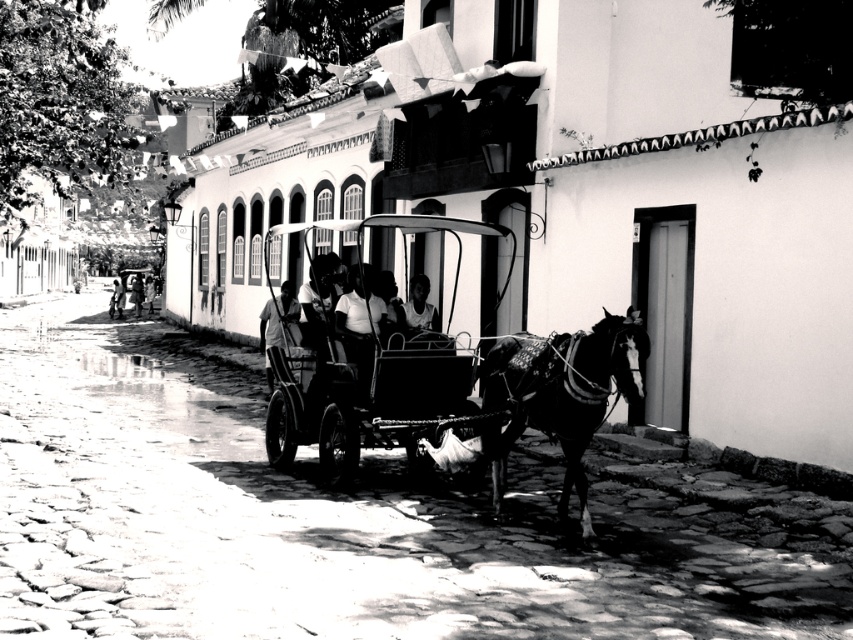
Question: Is shiny black horse at center to the left of smooth skin face at center from the viewer's perspective?

Choices:
 (A) yes
 (B) no

Answer: (B)

Question: Which of the following is the farthest from the observer?

Choices:
 (A) (422, 328)
 (B) (404, 220)
 (C) (515, 368)

Answer: (A)

Question: Can you confirm if metallic cart at center is positioned to the left of smooth skin face at center?

Choices:
 (A) no
 (B) yes

Answer: (B)

Question: Can you confirm if shiny black horse at center is positioned below smooth skin face at center?

Choices:
 (A) yes
 (B) no

Answer: (A)

Question: Which of the following is the farthest from the observer?

Choices:
 (A) (419, 324)
 (B) (136, 291)

Answer: (B)

Question: Which point is closer to the camera?

Choices:
 (A) metallic cart at center
 (B) smooth skin person at center
 (C) shiny black horse at center
 (D) smooth skin face at center

Answer: (C)